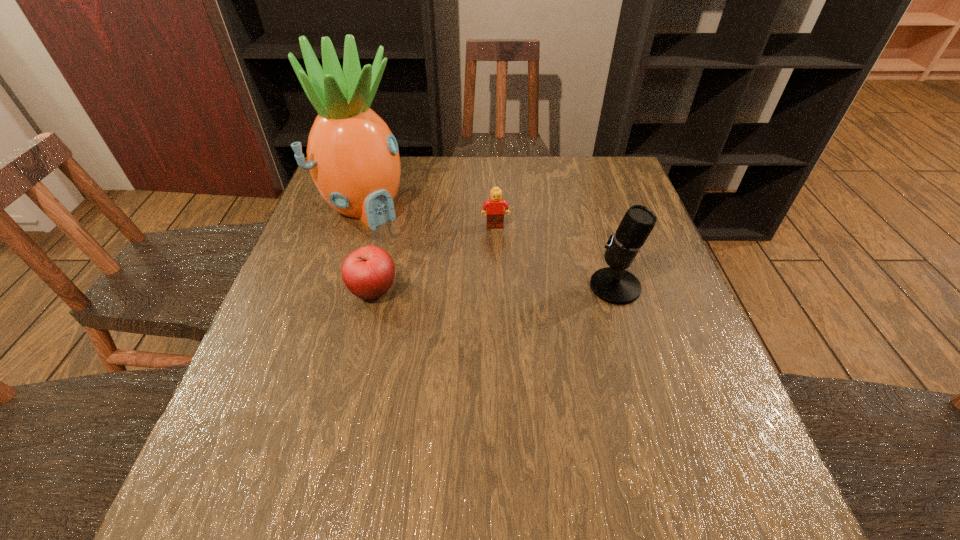
Where is `free space on the desktop that is between the apple and the rightmost object and is positioned at the entrance of the tallest object`? free space on the desktop that is between the apple and the rightmost object and is positioned at the entrance of the tallest object is located at coordinates (468, 289).

At what (x,y) coordinates should I click in order to perform the action: click on free space on the desktop that is between the apple and the microphone and is positioned on the face of the second object from right to left. Please return your answer as a coordinate pair (x, y). The height and width of the screenshot is (540, 960). Looking at the image, I should click on (501, 289).